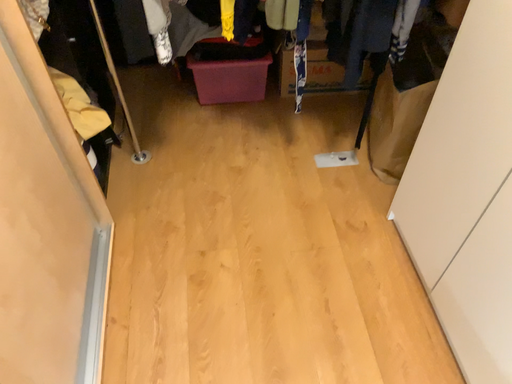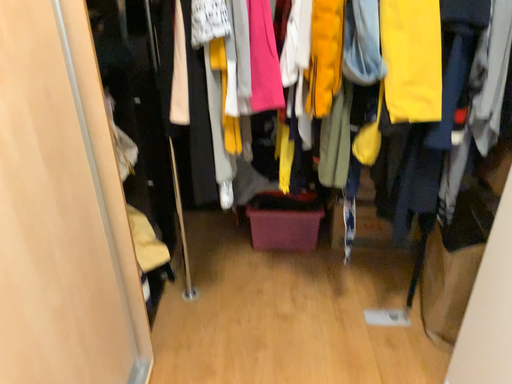
Question: Which way did the camera rotate in the video?

Choices:
 (A) rotated upward
 (B) rotated downward

Answer: (A)